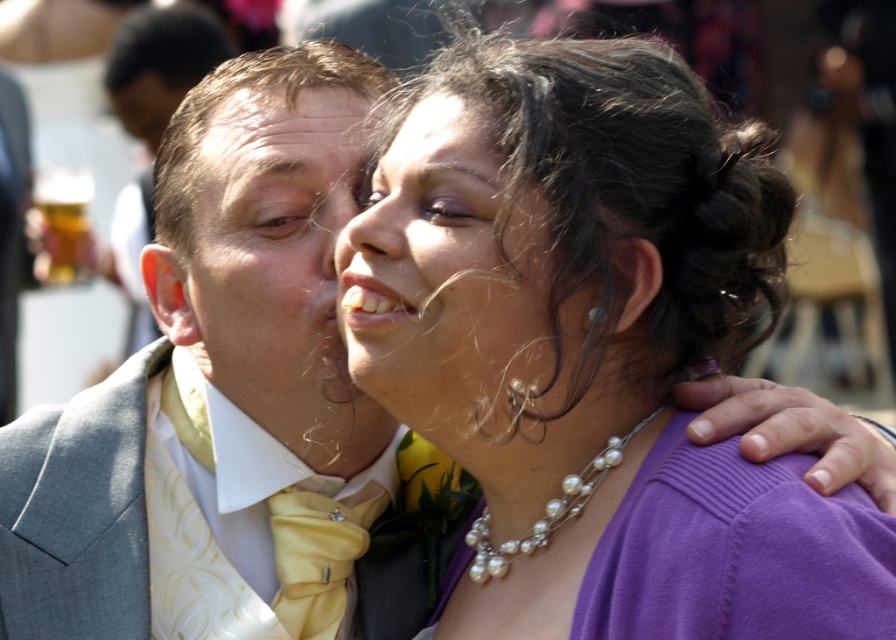
Is point (520, 205) farther from viewer compared to point (367, 518)?

No.

Between point (425, 182) and point (281, 621), which one is positioned behind?

Point (281, 621)

Locate an element on the screen. smooth skin face at center is located at coordinates (457, 284).

Looking at this image, is matte gray suit at left in front of matte yellow bow tie at left?

That is True.

Measure the distance between matte gray suit at left and camera.

matte gray suit at left is 2.12 meters from camera.

Does point (143, 472) lie behind point (332, 280)?

Yes, point (143, 472) is farther from viewer.

Image resolution: width=896 pixels, height=640 pixels. What are the coordinates of `matte gray suit at left` in the screenshot? It's located at (225, 397).

Based on the photo, who is positioned more to the left, purple fabric at center or matte gray suit at left?

From the viewer's perspective, matte gray suit at left appears more on the left side.

Locate an element on the screen. The image size is (896, 640). purple fabric at center is located at coordinates (593, 348).